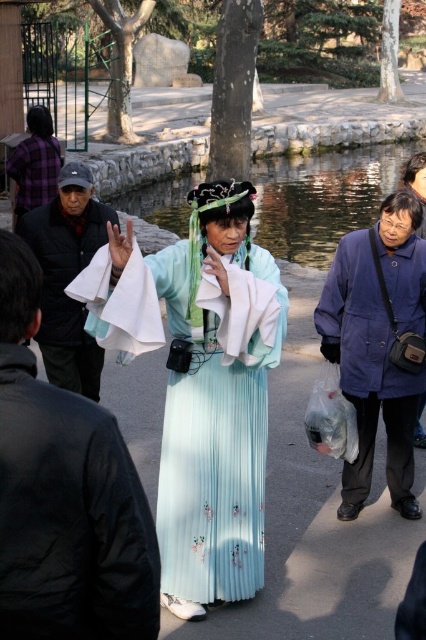
Can you confirm if dark gray fabric jacket at left is positioned to the left of white cotton towel at center?

Yes, dark gray fabric jacket at left is to the left of white cotton towel at center.

Is point (48, 237) in front of point (103, 308)?

No, (48, 237) is further to viewer.

You are a GUI agent. You are given a task and a screenshot of the screen. Output one action in this format:
    pyautogui.click(x=<x>, y=<y>)
    Task: Click on the dark gray fabric jacket at left
    
    Given the screenshot: What is the action you would take?
    pyautogui.click(x=68, y=276)

Is point (152, 301) closer to viewer compared to point (242, 330)?

Yes, point (152, 301) is in front of point (242, 330).

Between white cotton towel at center and light blue silk skirt at center, which one has more height?

white cotton towel at center

This screenshot has width=426, height=640. I want to click on white cotton towel at center, so 120,305.

Does light blue pleated dress at center have a lesser width compared to blue wool coat at right?

No, light blue pleated dress at center is not thinner than blue wool coat at right.

Is light blue pleated dress at center above blue wool coat at right?

No.

Which is behind, point (212, 307) or point (411, 310)?

Positioned behind is point (411, 310).

Where is `light blue pleated dress at center`? light blue pleated dress at center is located at coordinates (215, 403).